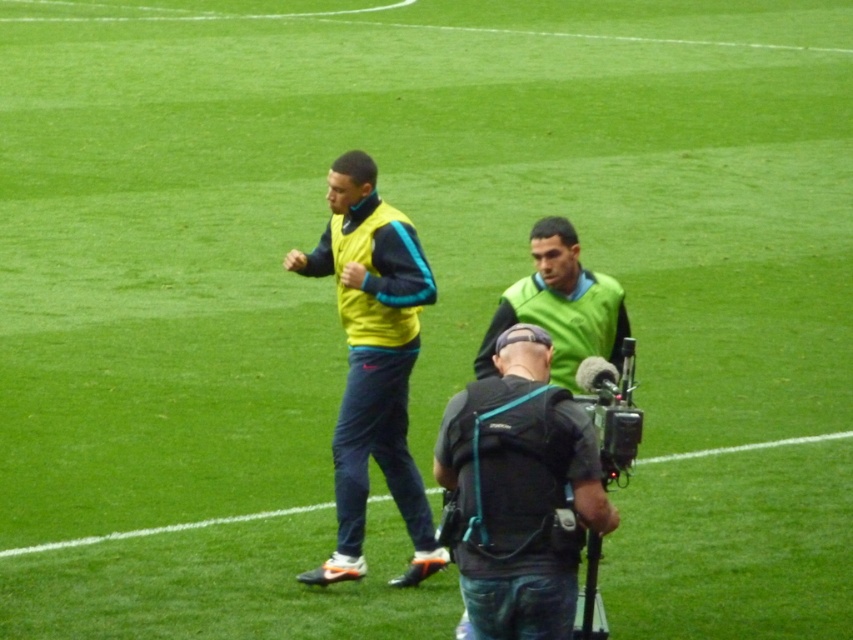
Question: Which object is closer to the camera taking this photo?

Choices:
 (A) green matte vest at center
 (B) black fabric camera at center
 (C) yellow matte vest at center

Answer: (B)

Question: Which point is closer to the camera?

Choices:
 (A) (601, 406)
 (B) (827, 433)
 (C) (598, 289)

Answer: (A)

Question: Is yellow matte vest at center to the right of green matte vest at center from the viewer's perspective?

Choices:
 (A) yes
 (B) no

Answer: (B)

Question: Can you confirm if green matte vest at center is smaller than black fabric camera at lower center?

Choices:
 (A) no
 (B) yes

Answer: (A)

Question: Which point appears closest to the camera in this image?

Choices:
 (A) (352, 486)
 (B) (560, 248)
 (C) (618, 394)
 (D) (548, 524)

Answer: (D)

Question: Is yellow matte vest at center further to the viewer compared to black plastic video camera at center?

Choices:
 (A) yes
 (B) no

Answer: (A)